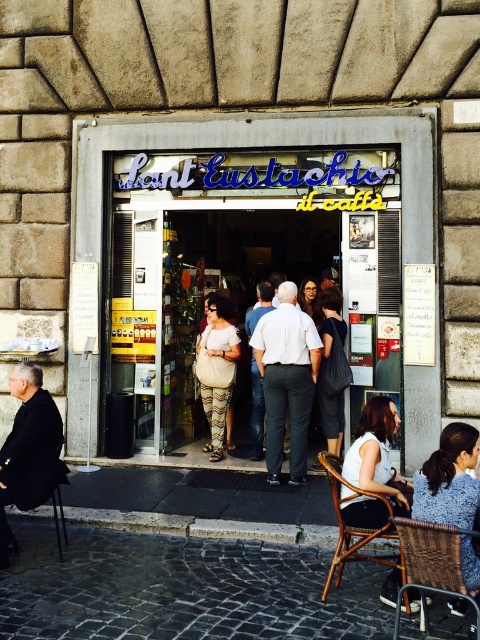
Question: Which of the following is the closest to the observer?

Choices:
 (A) woven brown chair at lower right
 (B) white matte shirt at center
 (C) matte white storefront at center
 (D) blue knitted sweater at lower right

Answer: (A)

Question: Among these points, which one is nearest to the camera?

Choices:
 (A) (309, 378)
 (B) (392, 563)

Answer: (B)

Question: Which point is farther to the camera?

Choices:
 (A) (211, 317)
 (B) (264, 333)

Answer: (A)

Question: Is metallic black chair at lower left thinner than beige textured bag at center?

Choices:
 (A) no
 (B) yes

Answer: (B)

Question: Observing the image, what is the correct spatial positioning of matte white storefront at center in reference to woven brown chair at lower right?

Choices:
 (A) above
 (B) below

Answer: (A)

Question: In this image, where is blue knitted sweater at lower right located relative to beige textured bag at center?

Choices:
 (A) left
 (B) right

Answer: (B)